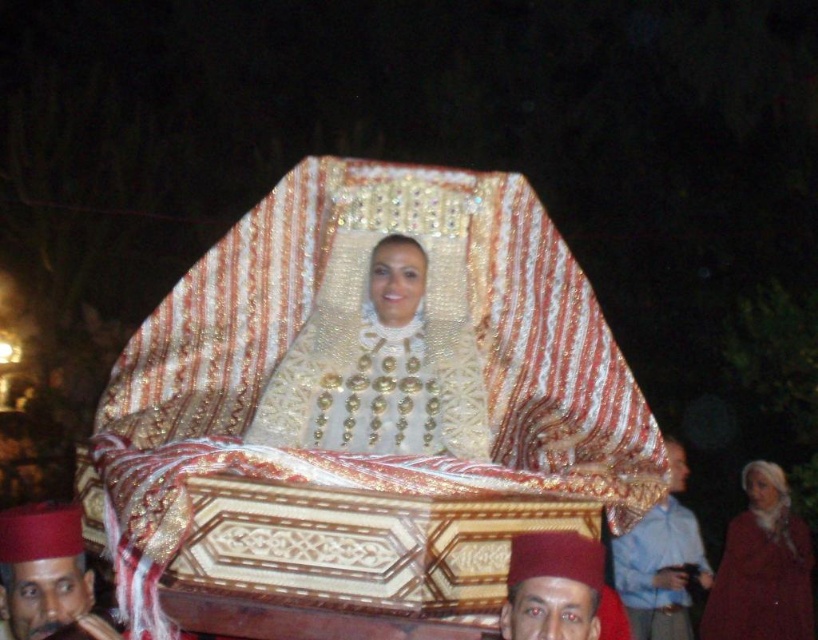
You are a photographer at the event and want to capture both the velvet maroon robe at lower right and the blue cotton shirt at lower right in the same frame. Which one should you focus on first to ensure both are in focus?

You should focus on the velvet maroon robe at lower right first because it is closer to you than the blue cotton shirt at lower right, so focusing on the closer one will ensure both are in focus.

You are a photographer at the event and want to capture both the velvet maroon robe at lower right and the matte red hat at lower left in a single frame. Which object should you focus on first to ensure both are in the frame?

The velvet maroon robe at lower right is much taller than the matte red hat at lower left, so you should focus on the velvet maroon robe at lower right first to ensure both are in the frame.